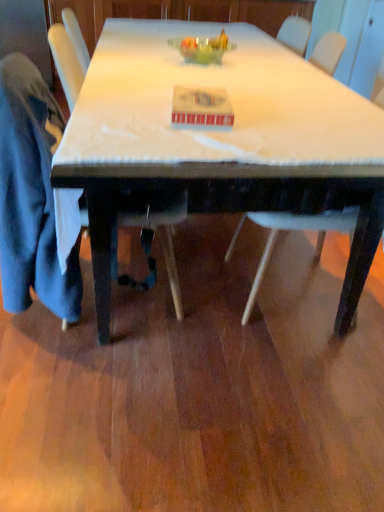
Where is `vacant area that is in front of velvet blue jacket at left, arranged as the first chair when viewed from the left`? This screenshot has width=384, height=512. vacant area that is in front of velvet blue jacket at left, arranged as the first chair when viewed from the left is located at coordinates (103, 388).